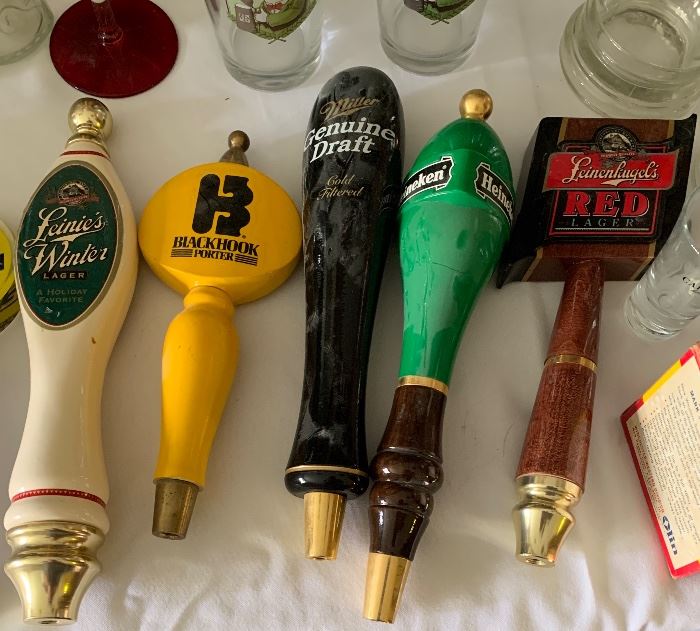
Where is `beer taps`? The width and height of the screenshot is (700, 631). beer taps is located at coordinates (603, 180), (438, 209), (351, 180), (206, 233), (68, 266).